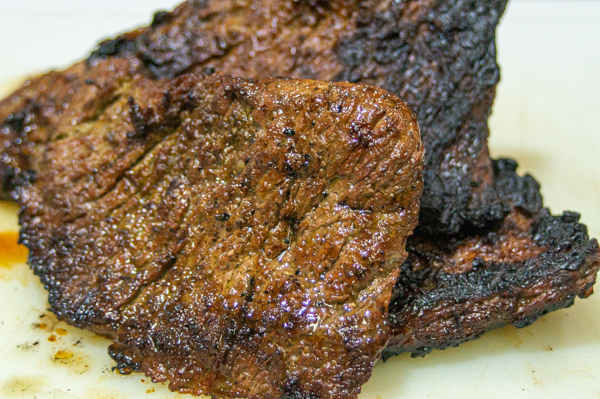
This screenshot has height=399, width=600. I want to click on cutting board, so click(x=515, y=385), click(x=554, y=88), click(x=66, y=29), click(x=19, y=367).